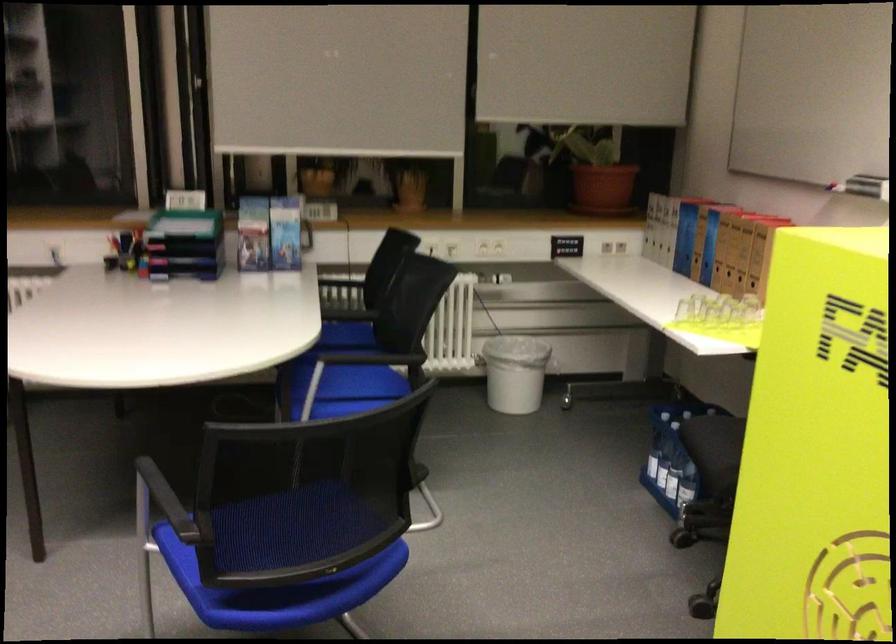
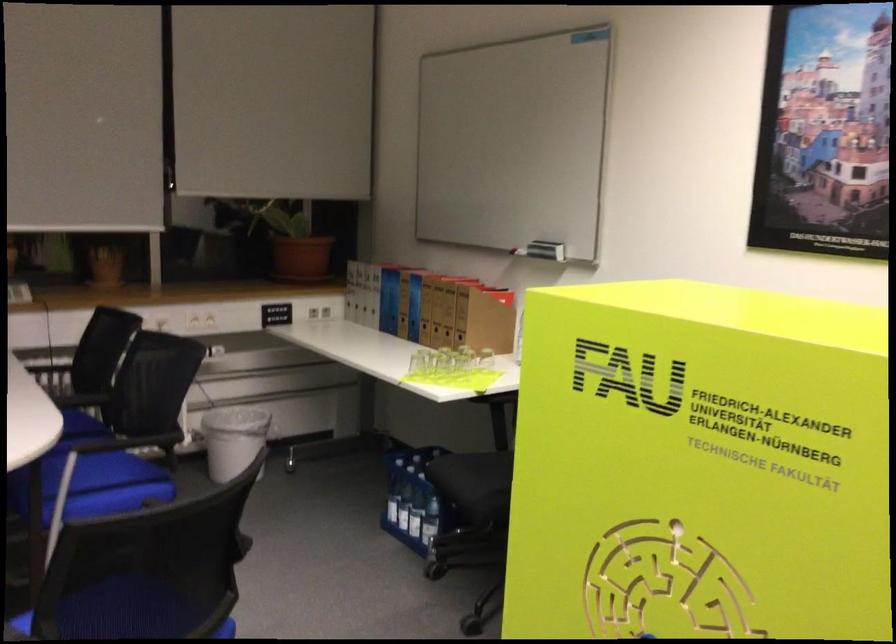
In the second image, find the point that corresponds to pixel 664 460 in the first image.

(403, 507)